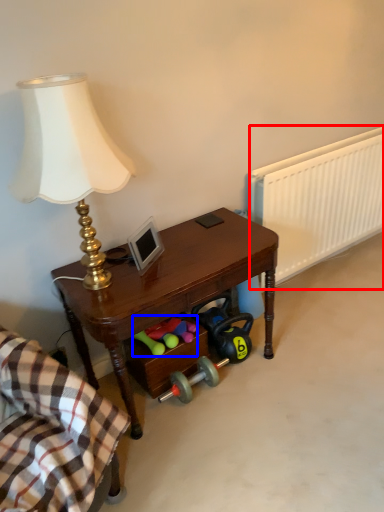
Question: Which of the following is the closest to the observer, radiator (highlighted by a red box) or stuff (highlighted by a blue box)?

Choices:
 (A) radiator
 (B) stuff

Answer: (B)